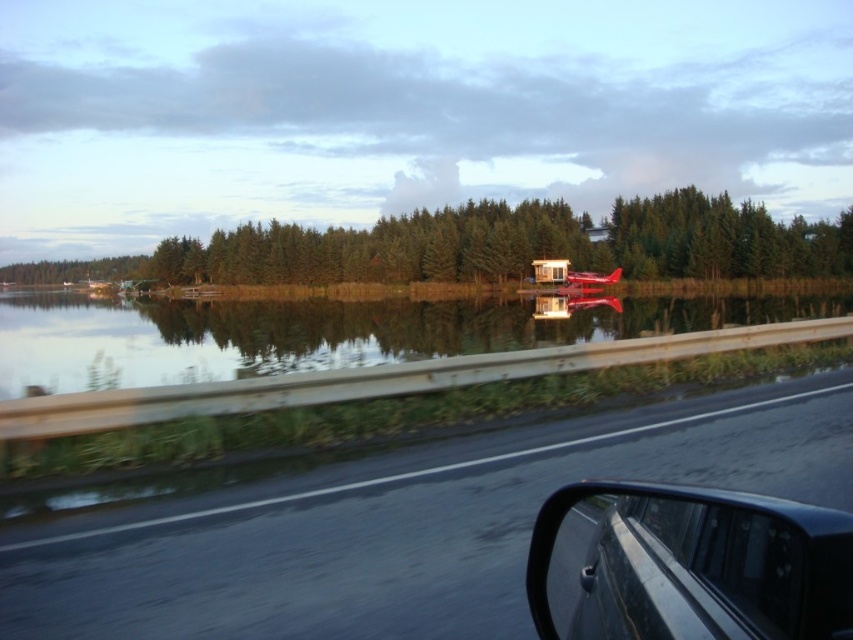
Between smooth water at center and black glossy car at lower right, which one is positioned lower?

black glossy car at lower right

Measure the distance between point (753, 317) and camera.

Point (753, 317) and camera are 15.79 meters apart.

Does point (158, 320) come closer to viewer compared to point (583, 516)?

No, it is behind (583, 516).

This screenshot has height=640, width=853. I want to click on smooth water at center, so click(321, 333).

From the picture: Can you confirm if black asphalt highway at center is shorter than black glossy car at lower right?

Indeed, black asphalt highway at center has a lesser height compared to black glossy car at lower right.

Can you confirm if black asphalt highway at center is taller than black glossy car at lower right?

No.

At what (x,y) coordinates should I click in order to perform the action: click on black asphalt highway at center. Please return your answer as a coordinate pair (x, y). The image size is (853, 640). Looking at the image, I should click on (401, 525).

Which is behind, point (770, 538) or point (811, 243)?

Positioned behind is point (811, 243).

Is black glossy car at lower right taller than green matte trees at center?

No.

Is point (734, 548) behind point (849, 237)?

No, (734, 548) is closer to viewer.

You are a GUI agent. You are given a task and a screenshot of the screen. Output one action in this format:
    pyautogui.click(x=<x>, y=<y>)
    Task: Click on the black glossy car at lower right
    The image size is (853, 640).
    Given the screenshot: What is the action you would take?
    pyautogui.click(x=688, y=564)